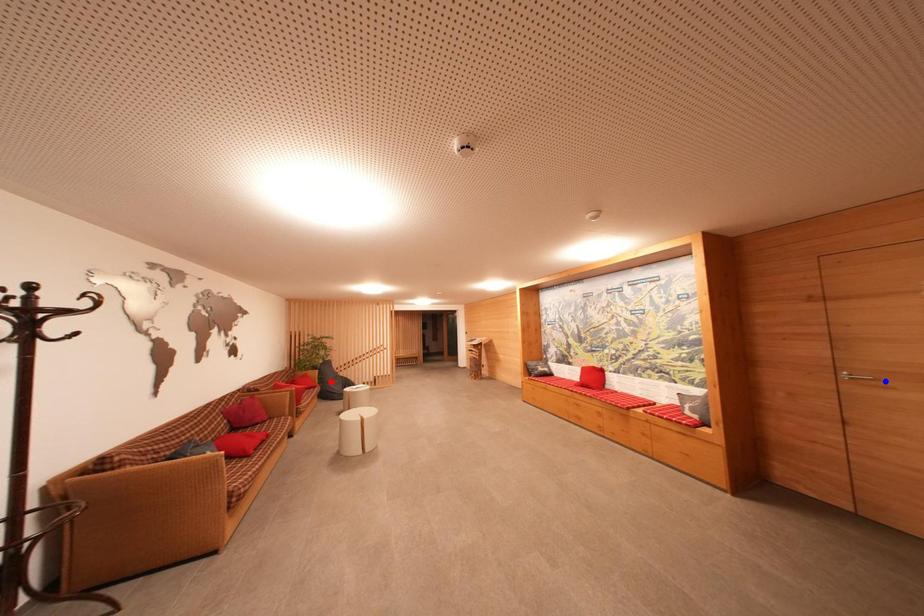
Question: In the image, two points are highlighted. Which point is nearer to the camera? Reply with the corresponding letter.

Choices:
 (A) blue point
 (B) red point

Answer: (A)